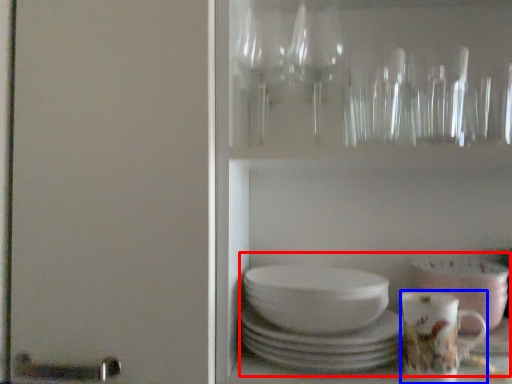
Question: Which object is closer to the camera taking this photo, tea set (highlighted by a red box) or coffee cup (highlighted by a blue box)?

Choices:
 (A) tea set
 (B) coffee cup

Answer: (A)